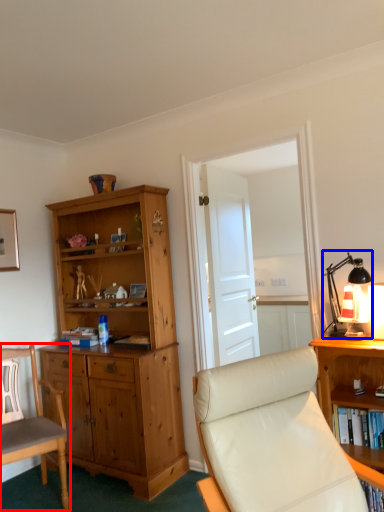
Question: Which of the following is the closest to the observer, chair (highlighted by a red box) or table lamp (highlighted by a blue box)?

Choices:
 (A) chair
 (B) table lamp

Answer: (B)